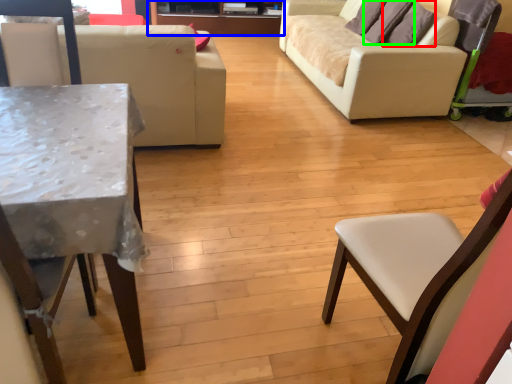
Question: Which is nearer to the pillow (highlighted by a red box)? entertainment center (highlighted by a blue box) or pillow (highlighted by a green box).

Choices:
 (A) entertainment center
 (B) pillow

Answer: (B)